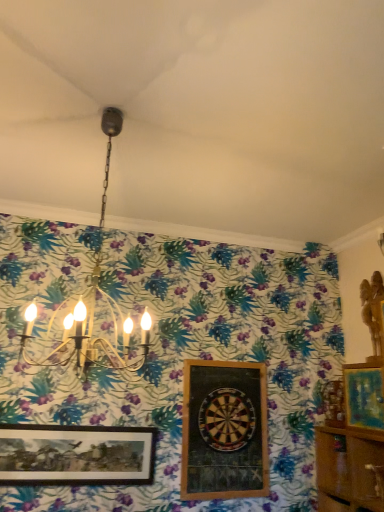
Measure the distance between gold metallic chandelier at upper center and camera.

The distance of gold metallic chandelier at upper center from camera is 6.56 feet.

You are a GUI agent. You are given a task and a screenshot of the screen. Output one action in this format:
    pyautogui.click(x=<x>, y=<y>)
    Task: Click on the wooden cabinet at lower right
    This screenshot has height=512, width=384.
    Given the screenshot: What is the action you would take?
    pyautogui.click(x=347, y=468)

What is the approximate height of wooden framed dartboard at center, the second picture frame when ordered from right to left?

It is 37.54 inches.

The height and width of the screenshot is (512, 384). Identify the location of teal matte painting at right, the first picture frame viewed from the right. (364, 395).

Can you tell me how much wooden dartboard at center and gold metallic chandelier at upper center differ in facing direction?

The facing directions of wooden dartboard at center and gold metallic chandelier at upper center are 2.24 degrees apart.

Is wooden dartboard at center wider than gold metallic chandelier at upper center?

Incorrect, the width of wooden dartboard at center does not surpass that of gold metallic chandelier at upper center.

Is wooden dartboard at center next to gold metallic chandelier at upper center?

No, wooden dartboard at center is not next to gold metallic chandelier at upper center.

Is wooden dartboard at center to the right of gold metallic chandelier at upper center from the viewer's perspective?

Correct, you'll find wooden dartboard at center to the right of gold metallic chandelier at upper center.

Which is farther from the camera, (381, 385) or (244, 420)?

Positioned behind is point (244, 420).

Considering the relative sizes of teal matte painting at right, the 3th picture frame viewed from the left, and wooden dartboard at center in the image provided, is teal matte painting at right, the 3th picture frame viewed from the left, bigger than wooden dartboard at center?

Correct, teal matte painting at right, the 3th picture frame viewed from the left, is larger in size than wooden dartboard at center.

Which object is wider, teal matte painting at right, the first picture frame viewed from the right, or wooden dartboard at center?

With larger width is teal matte painting at right, the first picture frame viewed from the right.

Does wooden dartboard at center appear on the left side of teal matte painting at right, the 3th picture frame viewed from the left?

Indeed, wooden dartboard at center is positioned on the left side of teal matte painting at right, the 3th picture frame viewed from the left.

Which picture frame is the 2nd one when counting from the front of the wooden dartboard at center? Please provide its 2D coordinates.

[(364, 395)]

Which object is wider, wooden dartboard at center or teal matte painting at right, the 3th picture frame viewed from the left?

With larger width is teal matte painting at right, the 3th picture frame viewed from the left.

Is wooden framed picture at lower left, placed as the third picture frame when sorted from right to left, at the back of gold metallic chandelier at upper center?

Yes, wooden framed picture at lower left, placed as the third picture frame when sorted from right to left, is at the back of gold metallic chandelier at upper center.

Based on the photo, does gold metallic chandelier at upper center have a smaller size compared to wooden framed picture at lower left, placed as the third picture frame when sorted from right to left?

Incorrect, gold metallic chandelier at upper center is not smaller in size than wooden framed picture at lower left, placed as the third picture frame when sorted from right to left.

Looking at this image, would you say gold metallic chandelier at upper center is to the left or to the right of wooden framed picture at lower left, the 1th picture frame when ordered from left to right, in the picture?

In the image, gold metallic chandelier at upper center appears on the right side of wooden framed picture at lower left, the 1th picture frame when ordered from left to right.

Is gold metallic chandelier at upper center taller than teal matte painting at right, the 3th picture frame viewed from the left?

Correct, gold metallic chandelier at upper center is much taller as teal matte painting at right, the 3th picture frame viewed from the left.

Is point (130, 329) positioned behind point (376, 381)?

Yes, point (130, 329) is farther from viewer.

Is gold metallic chandelier at upper center positioned behind teal matte painting at right, the 3th picture frame viewed from the left?

No, the depth of gold metallic chandelier at upper center is less than that of teal matte painting at right, the 3th picture frame viewed from the left.

Does teal matte painting at right, the first picture frame viewed from the right, have a smaller size compared to wooden cabinet at lower right?

Yes, teal matte painting at right, the first picture frame viewed from the right, is smaller than wooden cabinet at lower right.

What's the angular difference between teal matte painting at right, the first picture frame viewed from the right, and wooden cabinet at lower right's facing directions?

The angular difference between teal matte painting at right, the first picture frame viewed from the right, and wooden cabinet at lower right is 2.36 degrees.

From the image's perspective, relative to wooden cabinet at lower right, is teal matte painting at right, the 3th picture frame viewed from the left, above or below?

Clearly, from the image's perspective, teal matte painting at right, the 3th picture frame viewed from the left, is above wooden cabinet at lower right.

Considering the relative sizes of teal matte painting at right, the first picture frame viewed from the right, and wooden cabinet at lower right in the image provided, is teal matte painting at right, the first picture frame viewed from the right, taller than wooden cabinet at lower right?

Incorrect, the height of teal matte painting at right, the first picture frame viewed from the right, is not larger of that of wooden cabinet at lower right.

Is wooden framed picture at lower left, the 1th picture frame when ordered from left to right, positioned with its back to wooden framed dartboard at center, the second picture frame when ordered from right to left?

wooden framed picture at lower left, the 1th picture frame when ordered from left to right, is not turned away from wooden framed dartboard at center, the second picture frame when ordered from right to left.

Who is taller, wooden framed picture at lower left, the 1th picture frame when ordered from left to right, or wooden framed dartboard at center, the second picture frame when ordered from right to left?

Standing taller between the two is wooden framed dartboard at center, the second picture frame when ordered from right to left.

Looking at this image, is the surface of wooden framed picture at lower left, placed as the third picture frame when sorted from right to left, in direct contact with wooden framed dartboard at center, the second picture frame when ordered from right to left?

No, wooden framed picture at lower left, placed as the third picture frame when sorted from right to left, is not beside wooden framed dartboard at center, the second picture frame when ordered from right to left.

I want to click on design below the gold metallic chandelier at upper center (from the image's perspective), so click(227, 419).

The image size is (384, 512). What are the coordinates of `the 2nd picture frame in front of the wooden dartboard at center, counting from the anchor's position` in the screenshot? It's located at (364, 395).

Estimate the real-world distances between objects in this image. Which object is closer to wooden framed dartboard at center, the second picture frame when ordered from right to left, wooden dartboard at center or teal matte painting at right, the first picture frame viewed from the right?

wooden dartboard at center.

Based on their spatial positions, is wooden framed picture at lower left, placed as the third picture frame when sorted from right to left, or wooden framed dartboard at center, the second picture frame when ordered from right to left, further from gold metallic chandelier at upper center?

wooden framed dartboard at center, the second picture frame when ordered from right to left.

Based on their spatial positions, is gold metallic chandelier at upper center or wooden dartboard at center further from teal matte painting at right, the 3th picture frame viewed from the left?

gold metallic chandelier at upper center is positioned further to the anchor teal matte painting at right, the 3th picture frame viewed from the left.

Based on their spatial positions, is gold metallic chandelier at upper center or wooden framed dartboard at center, the second picture frame when ordered from right to left, further from teal matte painting at right, the first picture frame viewed from the right?

gold metallic chandelier at upper center is further to teal matte painting at right, the first picture frame viewed from the right.

When comparing their distances from wooden framed dartboard at center, the second picture frame when ordered from right to left, does wooden cabinet at lower right or gold metallic chandelier at upper center seem closer?

The object closer to wooden framed dartboard at center, the second picture frame when ordered from right to left, is wooden cabinet at lower right.

Estimate the real-world distances between objects in this image. Which object is further from wooden framed dartboard at center, which is counted as the 2th picture frame, starting from the left, teal matte painting at right, the 3th picture frame viewed from the left, or gold metallic chandelier at upper center?

teal matte painting at right, the 3th picture frame viewed from the left, lies further to wooden framed dartboard at center, which is counted as the 2th picture frame, starting from the left, than the other object.

Looking at the image, which one is located further to teal matte painting at right, the first picture frame viewed from the right, wooden framed dartboard at center, the second picture frame when ordered from right to left, or gold metallic chandelier at upper center?

gold metallic chandelier at upper center lies further to teal matte painting at right, the first picture frame viewed from the right, than the other object.

Based on their spatial positions, is wooden dartboard at center or wooden framed picture at lower left, the 1th picture frame when ordered from left to right, further from wooden framed dartboard at center, the second picture frame when ordered from right to left?

wooden framed picture at lower left, the 1th picture frame when ordered from left to right, is further to wooden framed dartboard at center, the second picture frame when ordered from right to left.

At what (x,y) coordinates should I click in order to perform the action: click on design between wooden framed picture at lower left, placed as the third picture frame when sorted from right to left, and wooden cabinet at lower right from left to right. Please return your answer as a coordinate pair (x, y). Image resolution: width=384 pixels, height=512 pixels. Looking at the image, I should click on (227, 419).

Where is `picture frame between gold metallic chandelier at upper center and teal matte painting at right, the first picture frame viewed from the right, in the horizontal direction`? This screenshot has height=512, width=384. picture frame between gold metallic chandelier at upper center and teal matte painting at right, the first picture frame viewed from the right, in the horizontal direction is located at coordinates (224, 431).

The image size is (384, 512). In order to click on shelf between wooden framed picture at lower left, placed as the third picture frame when sorted from right to left, and teal matte painting at right, the first picture frame viewed from the right, in the horizontal direction in this screenshot , I will do `click(347, 468)`.

You are a GUI agent. You are given a task and a screenshot of the screen. Output one action in this format:
    pyautogui.click(x=<x>, y=<y>)
    Task: Click on the picture frame between wooden framed picture at lower left, placed as the third picture frame when sorted from right to left, and wooden cabinet at lower right from left to right
    
    Given the screenshot: What is the action you would take?
    pos(224,431)